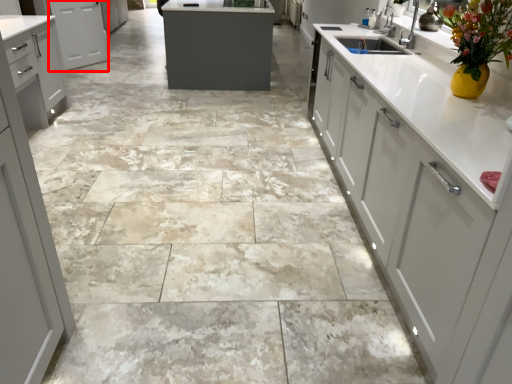
Question: Considering the relative positions of cabinetry (annotated by the red box) and cabinetry in the image provided, where is cabinetry (annotated by the red box) located with respect to the staircase?

Choices:
 (A) right
 (B) left

Answer: (B)